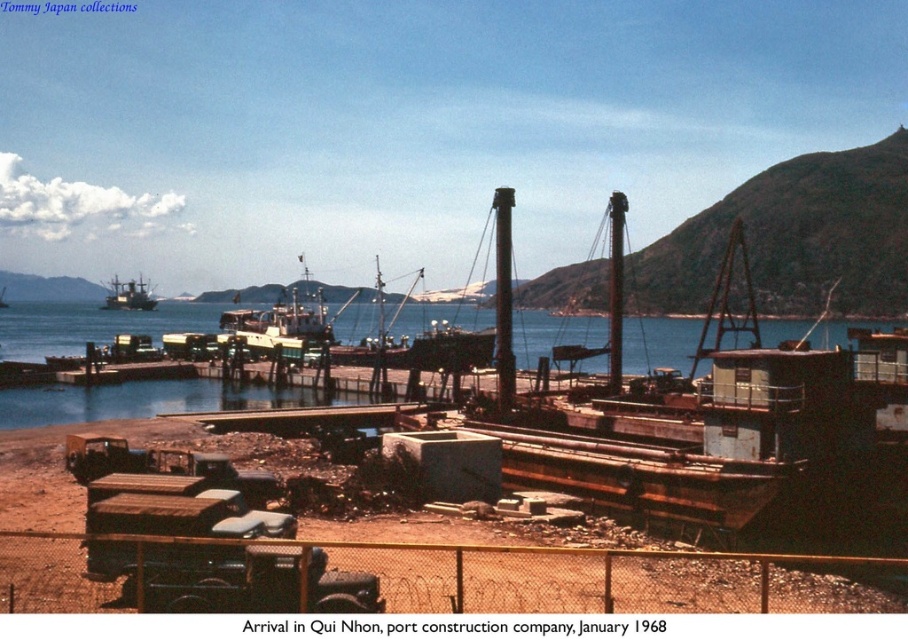
You are a photographer standing at the construction site in Qui Nhon, Vietnam. You want to capture a photo of the smooth blue water at center and the brushed metal boat at upper left. Which object will appear smaller in your photo?

The smooth blue water at center will appear smaller in the photo because it is shorter than the brushed metal boat at upper left.

You are a dock worker who needs to secure the rusty metal barge at center to the dock. The smooth blue water at center is where the barge is currently floating. Which object is located above the other?

The rusty metal barge at center is above the smooth blue water at center, so you should secure the rusty metal barge at center to the dock by anchoring it from above the smooth blue water at center.

You are standing at the construction site in the foreground of the port scene. There are two points marked in the image. The first point is at coordinate point (586,419) and the second point is at coordinate point (105,410). Which point is nearer to your current position?

Point (586,419) is closer to the camera than point (105,410), so the first point is nearer to your current position.